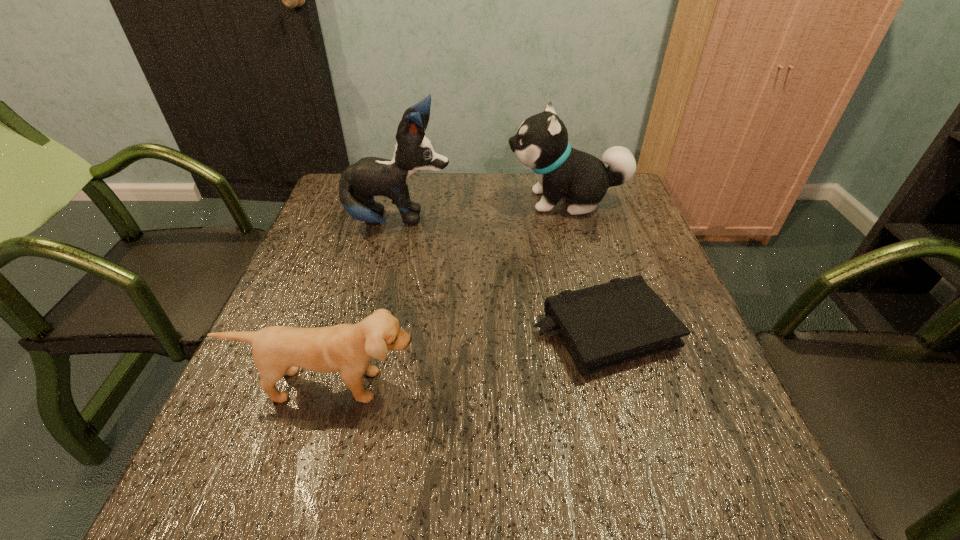
Identify the location of vacant area between the Bible and the tallest puppy. (501, 276).

In order to click on blank region between the tallest puppy and the shortest puppy in this screenshot , I will do `click(364, 303)`.

Identify the location of vacant point located between the second shortest object and the shortest object. (467, 358).

Find the location of a particular element. empty space that is in between the second shortest puppy and the shortest puppy is located at coordinates (447, 293).

Identify the location of free space between the second shortest object and the tallest object. (364, 303).

Find the location of a particular element. Image resolution: width=960 pixels, height=540 pixels. vacant area between the tallest object and the shortest object is located at coordinates (501, 276).

Identify the location of blank region between the shortest puppy and the shortest object. Image resolution: width=960 pixels, height=540 pixels. (467, 358).

At what (x,y) coordinates should I click in order to perform the action: click on vacant space in between the nearest puppy and the tallest object. Please return your answer as a coordinate pair (x, y). Image resolution: width=960 pixels, height=540 pixels. Looking at the image, I should click on (364, 303).

Find the location of a particular element. The image size is (960, 540). empty location between the tallest object and the second shortest puppy is located at coordinates (483, 211).

Where is `unoccupied position between the nearest puppy and the tallest puppy`? unoccupied position between the nearest puppy and the tallest puppy is located at coordinates (364, 303).